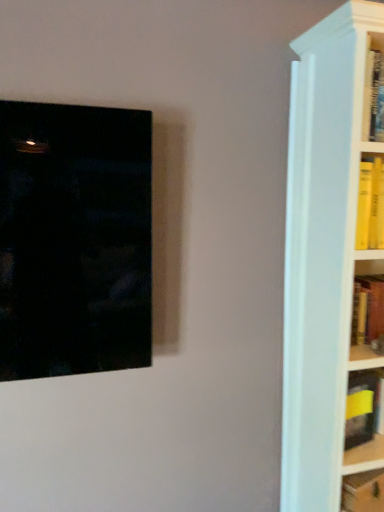
Question: From a real-world perspective, is matte black picture frame at left below yellow hardcover book at lower right, which appears as the 2th book when viewed from the top?

Choices:
 (A) yes
 (B) no

Answer: (B)

Question: Is matte black picture frame at left further to camera compared to yellow hardcover book at lower right, which appears as the 2th book when viewed from the top?

Choices:
 (A) yes
 (B) no

Answer: (B)

Question: From a real-world perspective, is matte black picture frame at left on top of yellow hardcover book at lower right, which appears as the 2th book when viewed from the top?

Choices:
 (A) yes
 (B) no

Answer: (A)

Question: Is matte black picture frame at left oriented towards yellow hardcover book at lower right, the first book from the bottom?

Choices:
 (A) yes
 (B) no

Answer: (B)

Question: Would you say matte black picture frame at left is outside yellow hardcover book at lower right, the first book from the bottom?

Choices:
 (A) no
 (B) yes

Answer: (B)

Question: From the image's perspective, relative to yellow hardcover book at lower right, which appears as the 2th book when viewed from the top, is yellow matte book at right, marked as the second book in a bottom-to-top arrangement, above or below?

Choices:
 (A) above
 (B) below

Answer: (A)

Question: Is yellow matte book at right, marked as the second book in a bottom-to-top arrangement, taller or shorter than yellow hardcover book at lower right, which appears as the 2th book when viewed from the top?

Choices:
 (A) tall
 (B) short

Answer: (A)

Question: In terms of size, does yellow matte book at right, which is the first book from top to bottom, appear bigger or smaller than yellow hardcover book at lower right, the first book from the bottom?

Choices:
 (A) small
 (B) big

Answer: (A)

Question: Would you say yellow matte book at right, marked as the second book in a bottom-to-top arrangement, is to the left or to the right of yellow hardcover book at lower right, the first book from the bottom, in the picture?

Choices:
 (A) left
 (B) right

Answer: (A)

Question: From a real-world perspective, relative to matte black picture frame at left, is yellow matte book at right, which is the first book from top to bottom, vertically above or below?

Choices:
 (A) below
 (B) above

Answer: (A)

Question: Considering their positions, is yellow matte book at right, which is the first book from top to bottom, located in front of or behind matte black picture frame at left?

Choices:
 (A) front
 (B) behind

Answer: (B)

Question: Does point (369, 388) appear closer or farther from the camera than point (46, 223)?

Choices:
 (A) farther
 (B) closer

Answer: (A)

Question: Based on their sizes in the image, would you say yellow matte book at right, which is the first book from top to bottom, is bigger or smaller than matte black picture frame at left?

Choices:
 (A) small
 (B) big

Answer: (A)

Question: In terms of height, does yellow hardcover book at lower right, which appears as the 2th book when viewed from the top, look taller or shorter compared to yellow matte book at right, marked as the second book in a bottom-to-top arrangement?

Choices:
 (A) short
 (B) tall

Answer: (A)

Question: In terms of width, does yellow hardcover book at lower right, which appears as the 2th book when viewed from the top, look wider or thinner when compared to yellow matte book at right, which is the first book from top to bottom?

Choices:
 (A) wide
 (B) thin

Answer: (A)